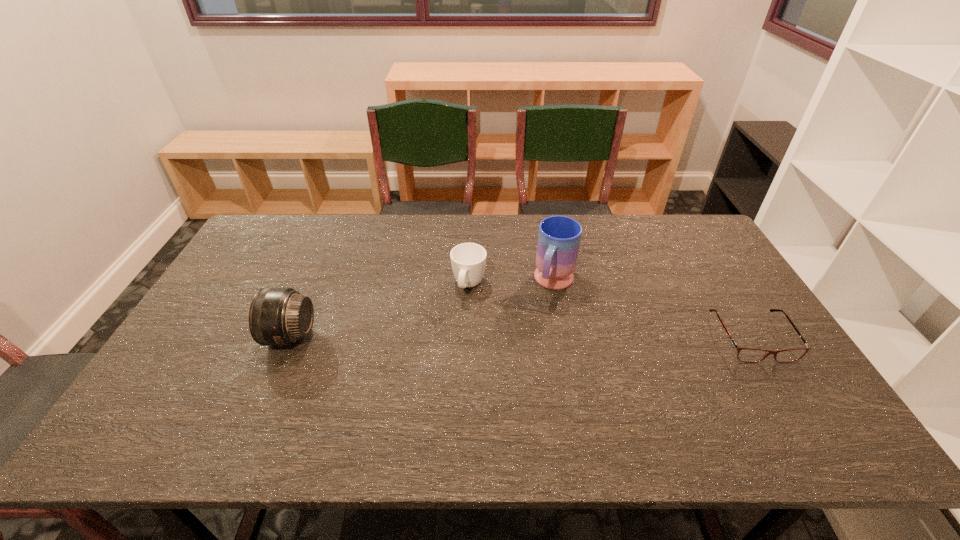
This screenshot has width=960, height=540. I want to click on vacant area that lies between the third object from right to left and the leftmost object, so click(x=379, y=311).

Identify the location of vacant space in between the second object from right to left and the shortest object. (654, 310).

The height and width of the screenshot is (540, 960). In order to click on empty space that is in between the mug and the cup in this screenshot , I will do (512, 284).

Identify the location of vacant area that lies between the second object from right to left and the shortest object. (654, 310).

Identify the location of free space between the second tallest object and the second object from left to right. (379, 311).

The width and height of the screenshot is (960, 540). Identify the location of the closest object to the second tallest object. (468, 260).

Where is `object that is the closest to the shortest object`? object that is the closest to the shortest object is located at coordinates (559, 237).